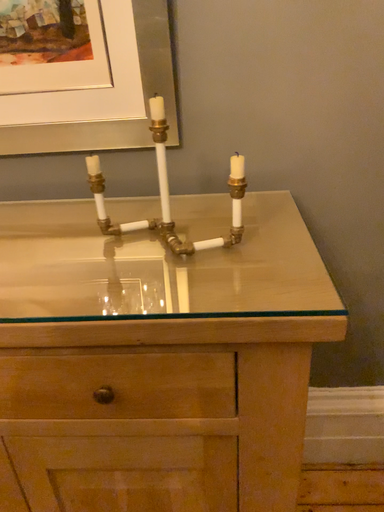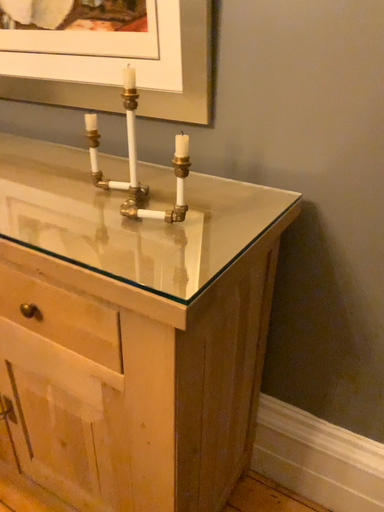
Question: Which way did the camera rotate in the video?

Choices:
 (A) rotated left
 (B) rotated right

Answer: (A)